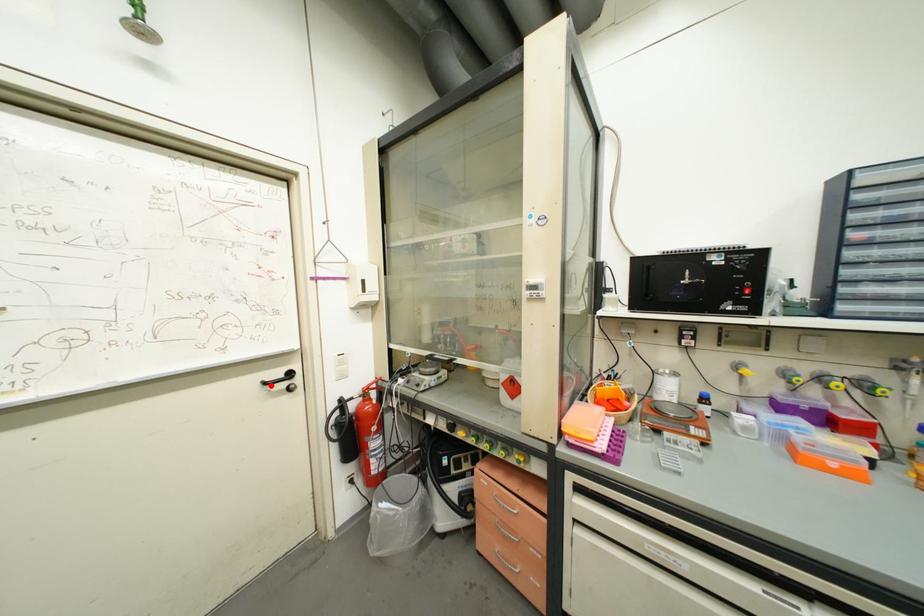
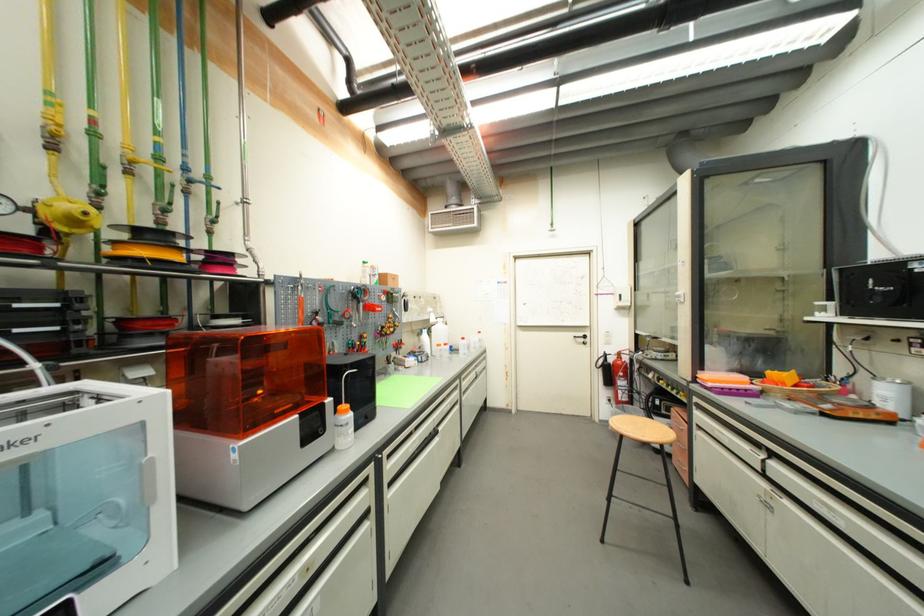
Question: I am providing you with two images of the same scene from different viewpoints. In image1, a red point is highlighted. Considering the same 3D point in image2, which of the following is correct?

Choices:
 (A) It is closer
 (B) It is farther

Answer: (B)